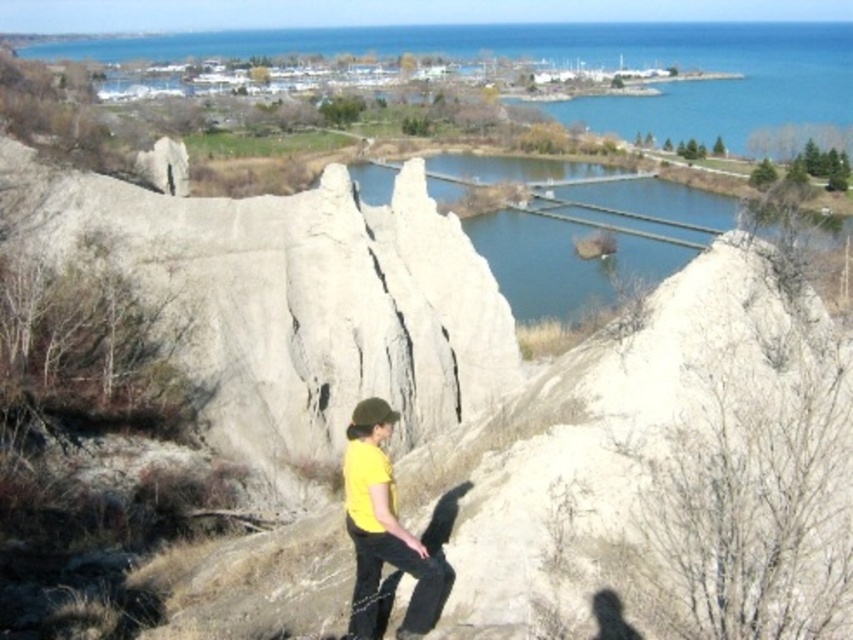
You are a hiker who wants to reach the white rough rock at center from your current position near the yellow matte shirt at center. Can you estimate how far you need to walk to get there?

The white rough rock at center is 20.69 meters away from the yellow matte shirt at center, so you need to walk approximately 20.69 meters to reach it.